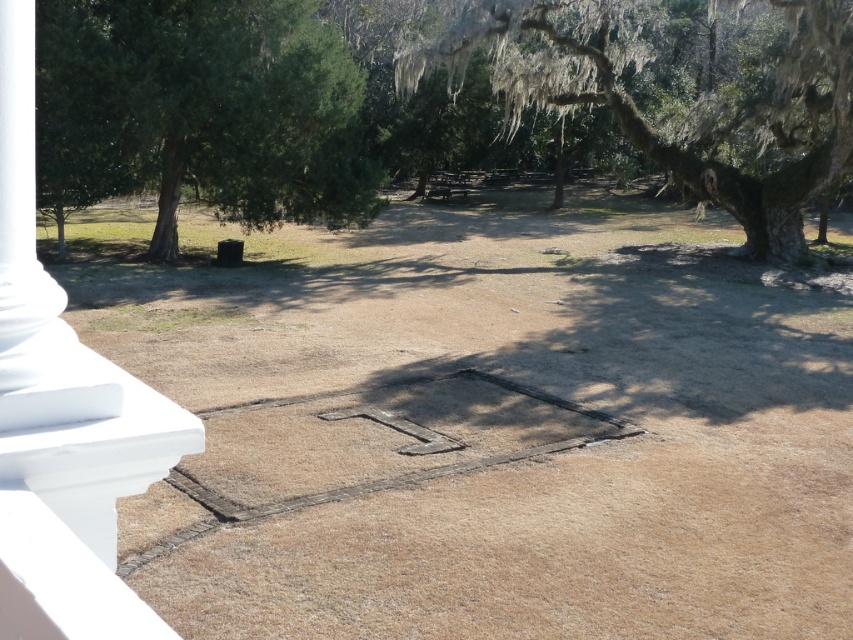
Question: Which object appears closest to the camera in this image?

Choices:
 (A) green leafy tree at upper left
 (B) green mossy tree at upper right

Answer: (B)

Question: Among these objects, which one is nearest to the camera?

Choices:
 (A) green leafy tree at upper left
 (B) green mossy tree at upper right

Answer: (B)

Question: Does green leafy tree at upper left appear on the right side of green mossy tree at upper right?

Choices:
 (A) no
 (B) yes

Answer: (A)

Question: Can you confirm if green leafy tree at upper left is smaller than green mossy tree at upper right?

Choices:
 (A) yes
 (B) no

Answer: (A)

Question: Which point is farther to the camera?

Choices:
 (A) green leafy tree at upper left
 (B) green mossy tree at upper right

Answer: (A)

Question: Can you confirm if green leafy tree at upper left is positioned above green mossy tree at upper right?

Choices:
 (A) yes
 (B) no

Answer: (B)